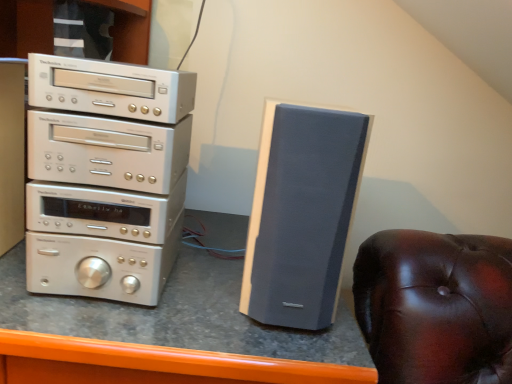
The height and width of the screenshot is (384, 512). Find the location of `blank area to the left of matte gray speaker at right`. blank area to the left of matte gray speaker at right is located at coordinates point(199,288).